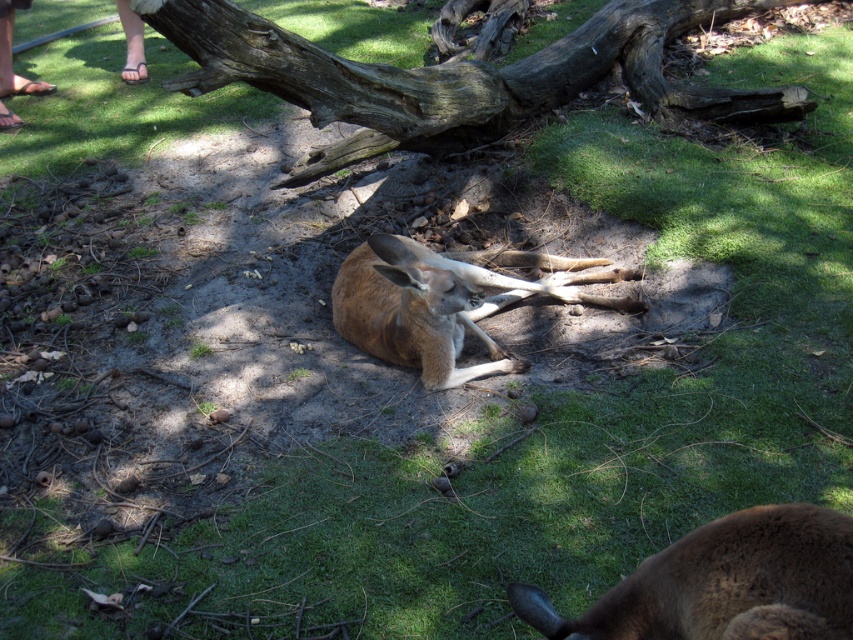
You are a photographer trying to capture a photo of the brown furry kangaroo at center. The dark brown wood at upper center is blocking part of the kangaroo. Can you adjust your position to avoid the wood blocking the kangaroo?

The dark brown wood at upper center is taller than the brown furry kangaroo at center, so lowering your camera angle or moving to a lower position might help avoid the obstruction caused by the dark brown wood at upper center.